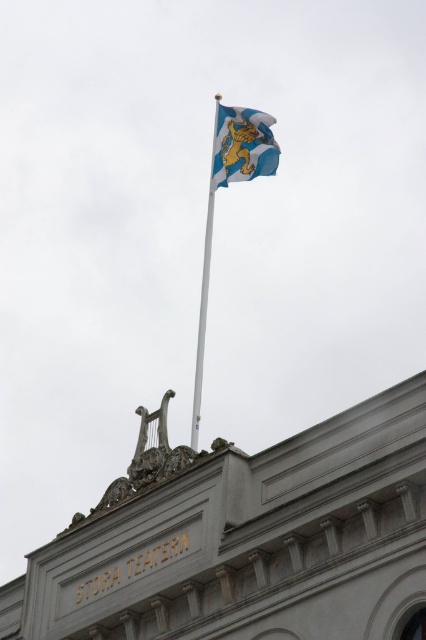
You are standing at the point marked as point [256,164]. You want to place a new decorative flagpole exactly 300 feet away from your current position. Based on the scene, will the new flagpole be placed beyond the existing flagpole on the building?

The existing flagpole is 278.73 feet away from point [256,164]. Since 278.73 feet is less than 300 feet, placing the new flagpole 300 feet away would require it to be placed beyond the existing flagpole on the building.

You are standing in front of the building and want to locate the blue and white fabric flag at upper center. According to the coordinates provided, where exactly is the flag positioned?

The blue and white fabric flag at upper center is positioned at coordinates point (242,145).

You are standing at the base of the flagpole holding the blue and white fabric flag at upper center. You want to throw a ball to hit the flag. The ball travels at 10 meters per second. How long will it take for the ball to reach the flag?

The blue and white fabric flag at upper center is 83.53 meters away from the camera. If the ball travels at 10 meters per second, it will take approximately 8.35 seconds to reach the flag.